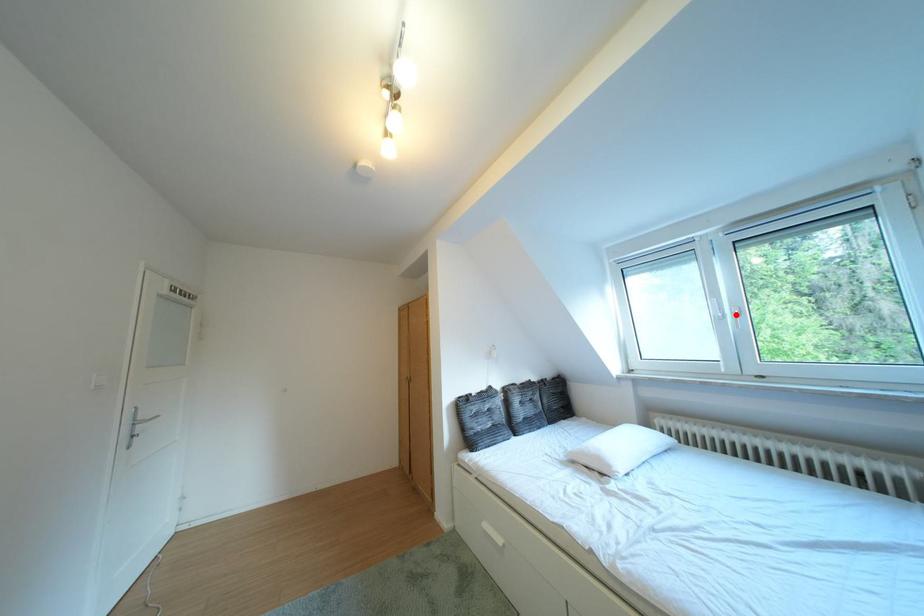
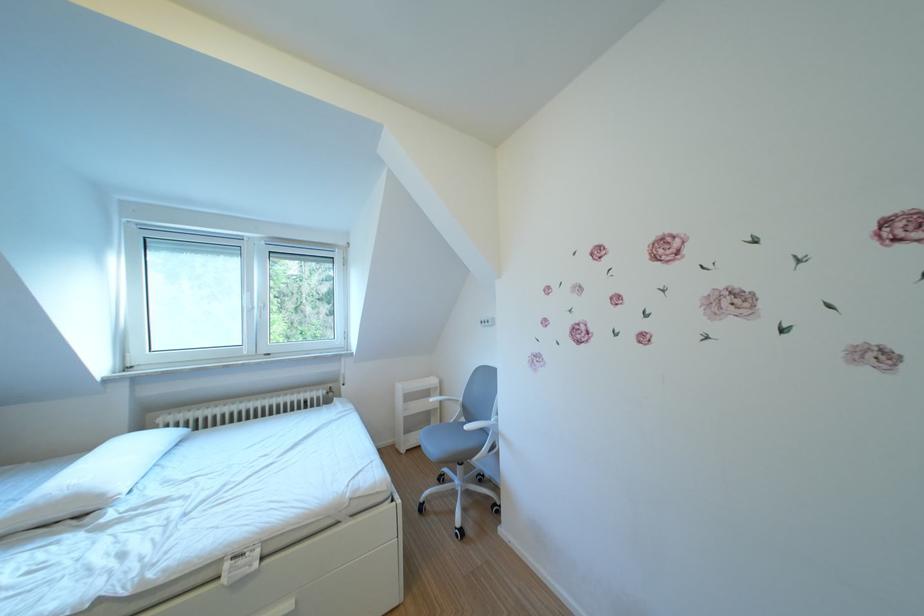
In the second image, find the point that corresponds to the highlighted location in the first image.

(265, 307)